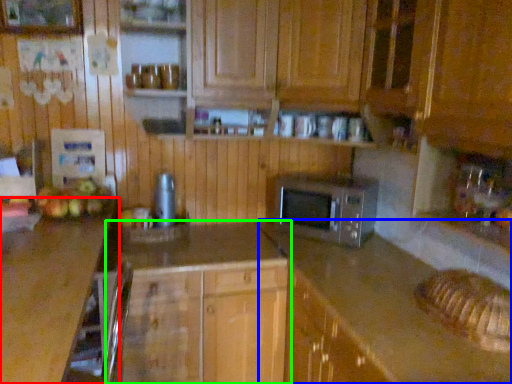
Question: Considering the real-world distances, which object is farthest from countertop (highlighted by a red box)? counter (highlighted by a blue box) or cabinetry (highlighted by a green box)?

Choices:
 (A) counter
 (B) cabinetry

Answer: (A)